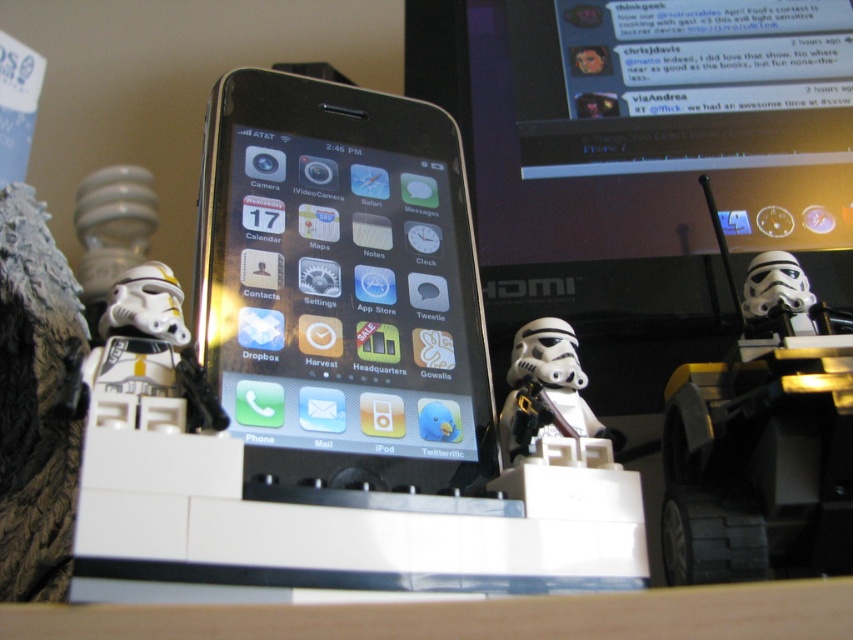
Does black glossy smartphone at center appear under white matte stormtrooper helmet at center?

Incorrect, black glossy smartphone at center is not positioned below white matte stormtrooper helmet at center.

Which is behind, point (412, 216) or point (579, 371)?

The point (412, 216) is more distant.

Locate an element on the screen. This screenshot has width=853, height=640. black glossy smartphone at center is located at coordinates (341, 285).

Can you confirm if black glossy smartphone at center is bigger than white plastic stormtrooper helmet at right?

Yes.

Does black glossy smartphone at center appear under white plastic stormtrooper helmet at right?

Incorrect, black glossy smartphone at center is not positioned below white plastic stormtrooper helmet at right.

This screenshot has height=640, width=853. I want to click on black glossy smartphone at center, so (341, 285).

Can you confirm if white plastic stormtrooper helmet at right is wider than white plastic stormtrooper at left?

Correct, the width of white plastic stormtrooper helmet at right exceeds that of white plastic stormtrooper at left.

Based on the photo, which is more to the left, white plastic stormtrooper helmet at right or white plastic stormtrooper at left?

white plastic stormtrooper at left is more to the left.

Who is more distant from viewer, (700, 564) or (143, 385)?

Positioned behind is point (143, 385).

Find the location of a particular element. This screenshot has width=853, height=640. white plastic stormtrooper helmet at right is located at coordinates (762, 442).